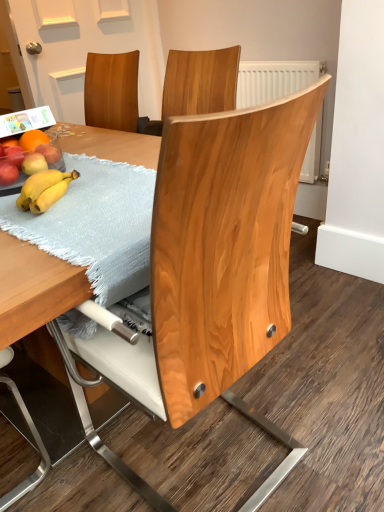
I want to click on free point to the right of yellow matte apple at left, arranged as the 3th apple when viewed from the back, so click(x=100, y=170).